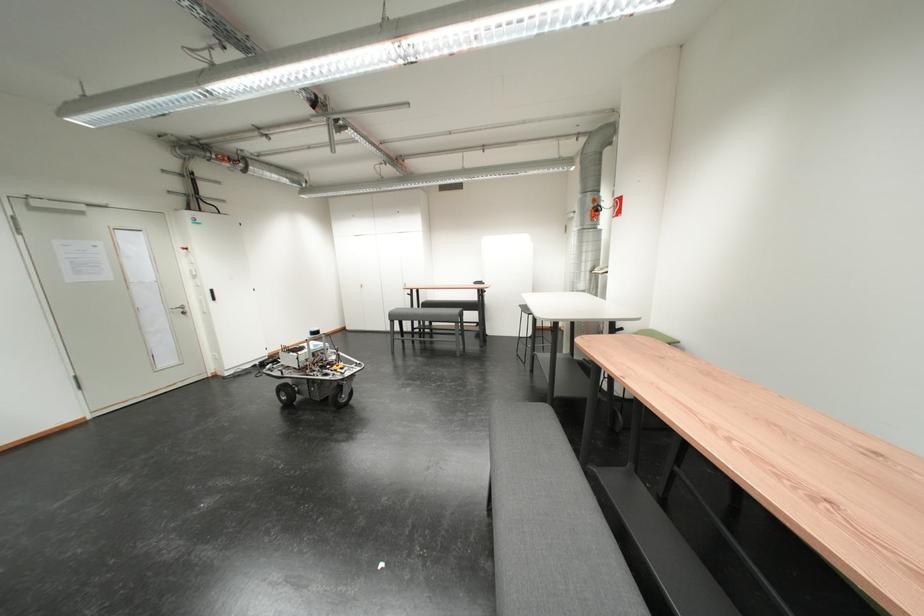
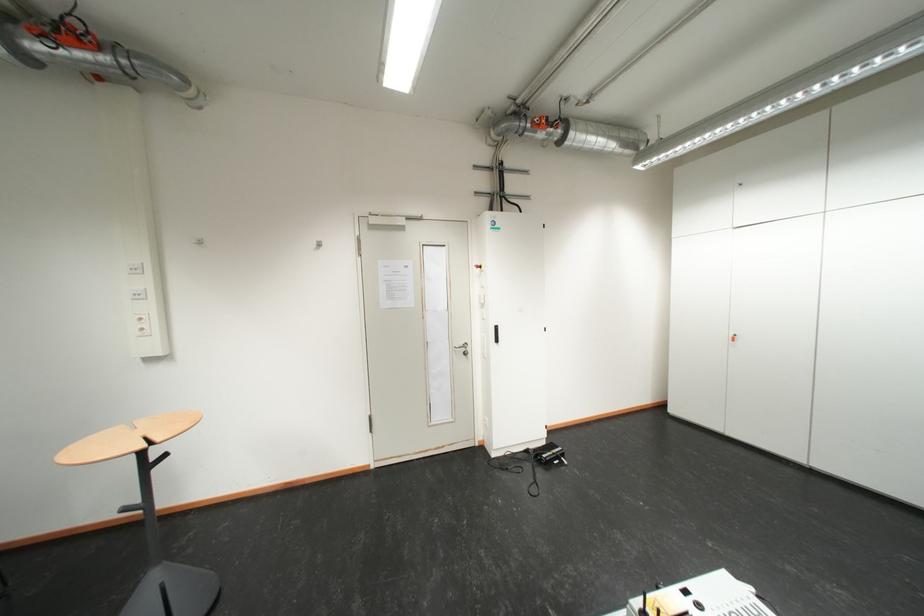
Find the pixel in the second image that matches pixel 228 160 in the first image.

(543, 126)